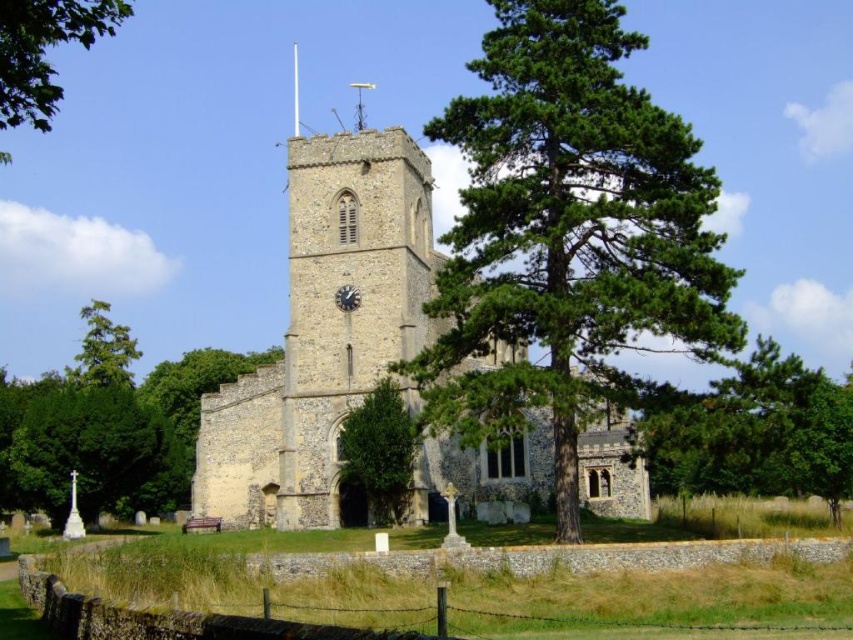
Who is more distant from viewer, [335,449] or [125,376]?

Point [125,376]

Is point (415, 353) more distant than point (94, 384)?

No, (415, 353) is closer to viewer.

Is point (612, 451) positioned before point (126, 385)?

That is True.

This screenshot has height=640, width=853. What are the coordinates of `stone church at center` in the screenshot? It's located at click(323, 332).

This screenshot has width=853, height=640. Describe the element at coordinates (108, 426) in the screenshot. I see `green leafy tree at lower left` at that location.

Is point (68, 381) farther from camera compared to point (131, 337)?

No, (68, 381) is closer to viewer.

Find the location of `green leafy tree at lower left`. green leafy tree at lower left is located at coordinates (108, 426).

In the scene shown: Does green textured pine tree at left have a lesser width compared to metallic clock face at center?

No.

Does point (102, 339) come closer to viewer compared to point (340, 289)?

No.

Is point (90, 358) closer to viewer compared to point (349, 308)?

No, it is behind (349, 308).

At what (x,y) coordinates should I click in order to perform the action: click on green textured pine tree at left. Please return your answer as a coordinate pair (x, y). This screenshot has height=640, width=853. Looking at the image, I should click on (103, 349).